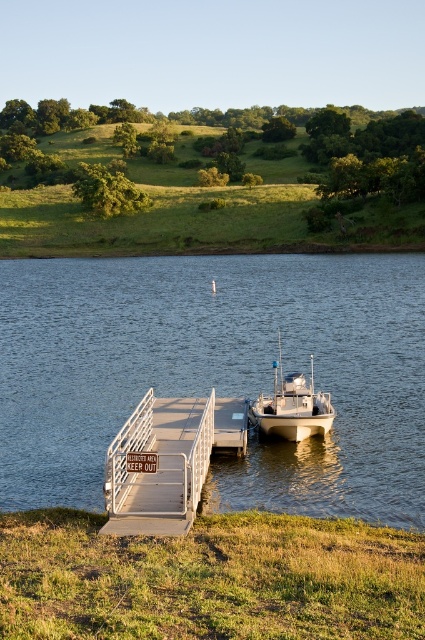
Question: Is green grassy hillside at upper center wider than white matte boat at center?

Choices:
 (A) yes
 (B) no

Answer: (A)

Question: Which point is closer to the camera taking this photo?

Choices:
 (A) (159, 467)
 (B) (57, 205)
 (C) (410, 397)
 (D) (326, 417)

Answer: (A)

Question: Which object is farther from the camera taking this photo?

Choices:
 (A) green grassy hillside at upper center
 (B) clear water at dock right
 (C) white metal dock at center
 (D) white matte boat at center

Answer: (A)

Question: Does clear water at dock right have a larger size compared to white matte boat at center?

Choices:
 (A) no
 (B) yes

Answer: (B)

Question: Which point appears farthest from the camera in this image?

Choices:
 (A) (136, 227)
 (B) (181, 525)
 (C) (382, 369)
 (D) (329, 406)

Answer: (A)

Question: Can you confirm if clear water at dock right is wider than white matte boat at center?

Choices:
 (A) yes
 (B) no

Answer: (A)